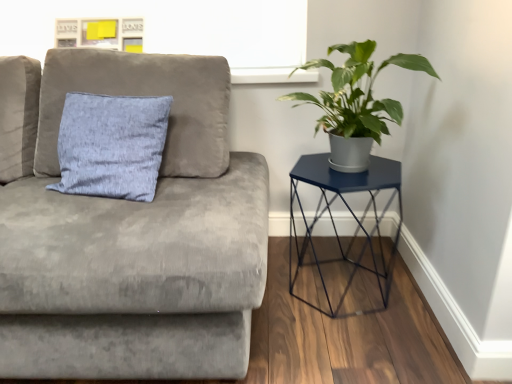
Question: Is green matte plant at right completely or partially inside velvet gray couch at upper left?

Choices:
 (A) no
 (B) yes

Answer: (A)

Question: Does velvet gray couch at upper left have a smaller size compared to green matte plant at right?

Choices:
 (A) no
 (B) yes

Answer: (A)

Question: Is velvet gray couch at upper left to the right of green matte plant at right from the viewer's perspective?

Choices:
 (A) yes
 (B) no

Answer: (B)

Question: Is the position of velvet gray couch at upper left more distant than that of green matte plant at right?

Choices:
 (A) no
 (B) yes

Answer: (A)

Question: Are velvet gray couch at upper left and green matte plant at right located far from each other?

Choices:
 (A) yes
 (B) no

Answer: (B)

Question: From the image's perspective, is velvet gray couch at upper left over green matte plant at right?

Choices:
 (A) no
 (B) yes

Answer: (A)

Question: Is metallic blue hexagonal table at right surrounding green matte plant at right?

Choices:
 (A) no
 (B) yes

Answer: (A)

Question: Does metallic blue hexagonal table at right have a lesser width compared to green matte plant at right?

Choices:
 (A) yes
 (B) no

Answer: (B)

Question: From a real-world perspective, is metallic blue hexagonal table at right below green matte plant at right?

Choices:
 (A) yes
 (B) no

Answer: (A)

Question: Is the position of metallic blue hexagonal table at right less distant than that of green matte plant at right?

Choices:
 (A) no
 (B) yes

Answer: (A)

Question: Considering the relative positions of metallic blue hexagonal table at right and green matte plant at right in the image provided, is metallic blue hexagonal table at right to the right of green matte plant at right from the viewer's perspective?

Choices:
 (A) yes
 (B) no

Answer: (A)

Question: Is metallic blue hexagonal table at right not near green matte plant at right?

Choices:
 (A) yes
 (B) no

Answer: (B)

Question: Can you confirm if green matte plant at right is smaller than metallic blue hexagonal table at right?

Choices:
 (A) yes
 (B) no

Answer: (A)